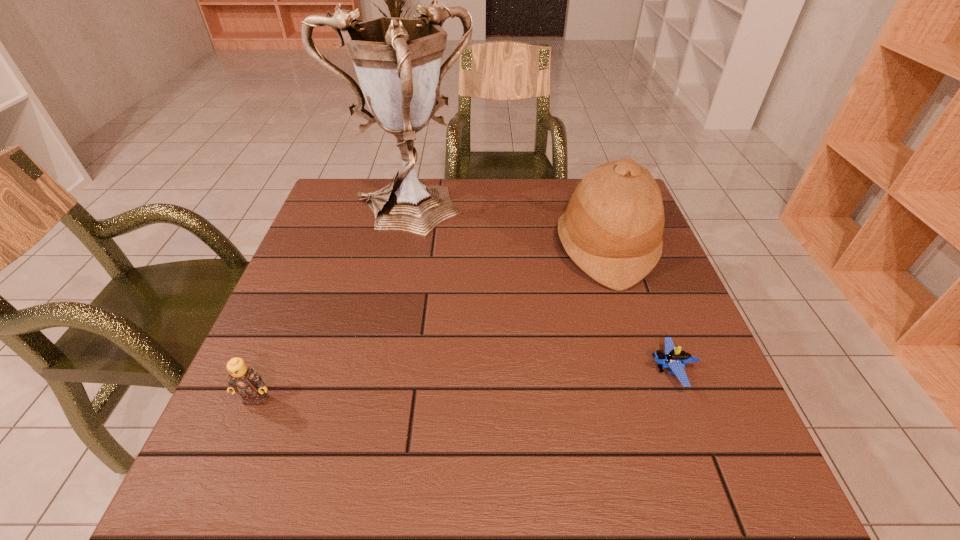
You are a GUI agent. You are given a task and a screenshot of the screen. Output one action in this format:
    pyautogui.click(x=<x>, y=<y>)
    Task: Click on the vacant area that lies between the right Lego and the tallest object
    Image resolution: width=960 pixels, height=540 pixels.
    Given the screenshot: What is the action you would take?
    pyautogui.click(x=538, y=293)

Identify the location of vacant area that lies between the left Lego and the shortest object. The width and height of the screenshot is (960, 540). (464, 385).

Locate an element on the screen. vacant space that is in between the hat and the trophy cup is located at coordinates (505, 232).

You are a GUI agent. You are given a task and a screenshot of the screen. Output one action in this format:
    pyautogui.click(x=<x>, y=<y>)
    Task: Click on the vacant area that lies between the third tallest object and the third shortest object
    The width and height of the screenshot is (960, 540).
    Given the screenshot: What is the action you would take?
    click(430, 323)

The image size is (960, 540). Identify the location of free space between the hat and the trophy cup. (505, 232).

This screenshot has width=960, height=540. Find the location of `vacant space that's between the hat and the tallest object`. vacant space that's between the hat and the tallest object is located at coordinates (505, 232).

The height and width of the screenshot is (540, 960). Identify the location of the second closest object relative to the third shortest object. (397, 60).

You are a GUI agent. You are given a task and a screenshot of the screen. Output one action in this format:
    pyautogui.click(x=<x>, y=<y>)
    Task: Click on the object that is the closest to the hat
    
    Given the screenshot: What is the action you would take?
    pyautogui.click(x=674, y=358)

The height and width of the screenshot is (540, 960). I want to click on vacant position in the image that satisfies the following two spatial constraints: 1. on the front-facing side of the hat; 2. in front of the left Lego, so click(654, 399).

Identify the location of blank space that satisfies the following two spatial constraints: 1. on the front-facing side of the hat; 2. in front of the second shortest object. Image resolution: width=960 pixels, height=540 pixels. (654, 399).